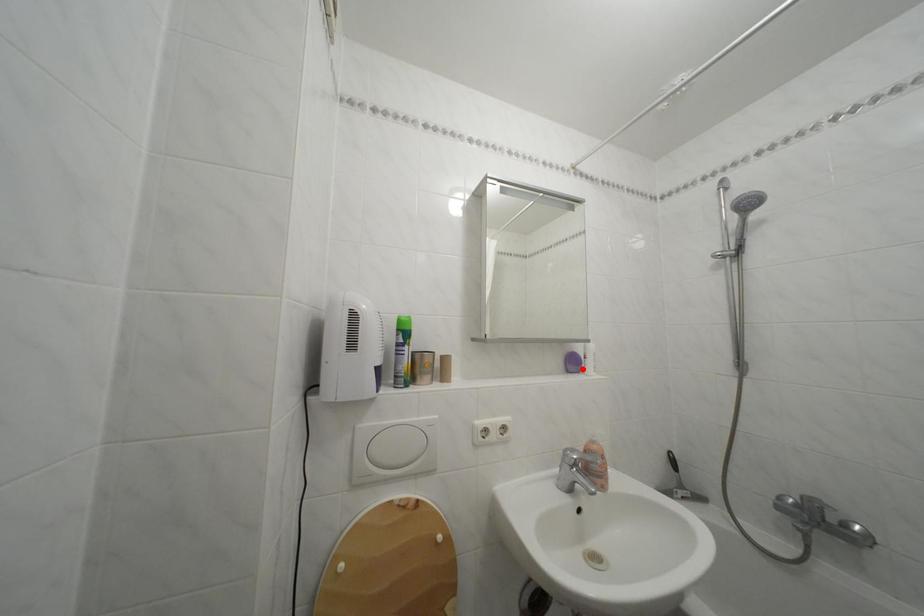
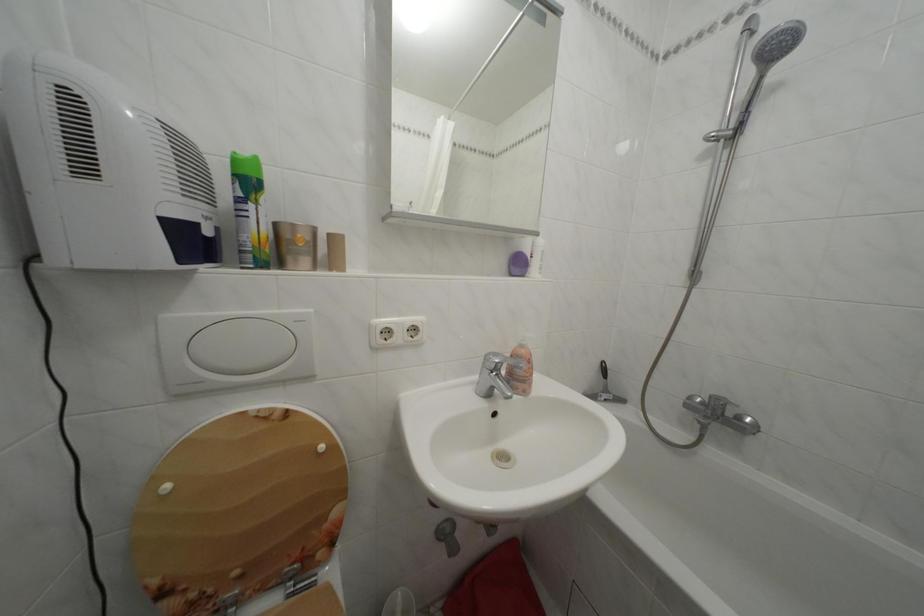
The point at the highlighted location is marked in the first image. Where is the corresponding point in the second image?

(527, 270)